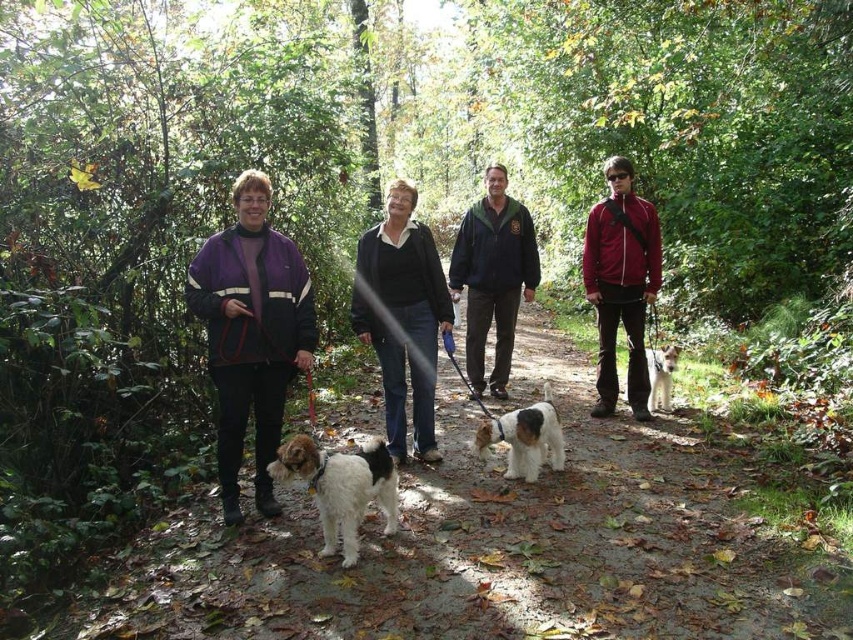
You are standing at the point labeled as point (x=621, y=284) in the image. What color is the jacket of the person closest to you?

The point (x=621, y=284) is on the matte red jacket at right, so the closest person to you is wearing a matte red jacket.

You are a photographer trying to capture a clear shot of the matte red jacket at right and the white fur at center. Since you want to ensure both are in focus, you need to know their relative sizes. Which object is bigger?

The matte red jacket at right is larger in size compared to the white fur at center, so you should adjust your camera settings to accommodate the larger size of the matte red jacket at right for better focus.